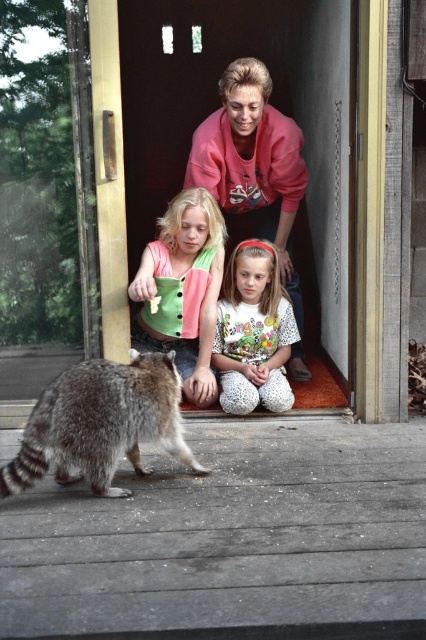
You are a photographer trying to capture a group photo of the pink fleece at center and the white dotted pants at lower center. Which object is wider so that it can be centered in the frame more easily?

The pink fleece at center is wider than the white dotted pants at lower center, so it can be centered in the frame more easily.

You are standing at the glass door observing the scene. You notice the pink fleece at center and the white dotted pants at lower center. Which item is larger in size?

The pink fleece at center is bigger than the white dotted pants at lower center.

You are standing at the glass door looking out at the wooden deck. There are two points marked on the deck. One is at point A located at coordinate point[203,186] and the other is at point B located at coordinate point[290,312]. Which point is closer to you?

Point A located at coordinate point[203,186] is closer to you than point B located at coordinate point[290,312] because it is nearer to the camera.